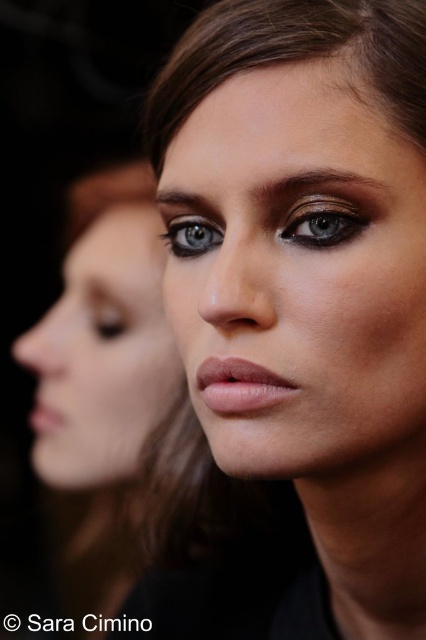
Can you confirm if matte skin face at center is positioned above matte brown eye at center?

Actually, matte skin face at center is below matte brown eye at center.

What do you see at coordinates (103, 355) in the screenshot?
I see `matte skin face at center` at bounding box center [103, 355].

Where is `matte skin face at center`? This screenshot has width=426, height=640. matte skin face at center is located at coordinates (103, 355).

Does matte skin face at center have a greater height compared to dark brown eyebrow at upper center?

Indeed, matte skin face at center has a greater height compared to dark brown eyebrow at upper center.

Is matte skin face at center to the right of dark brown eyebrow at upper center from the viewer's perspective?

No, matte skin face at center is not to the right of dark brown eyebrow at upper center.

Is point (132, 320) closer to viewer compared to point (198, 196)?

No, it is not.

What are the coordinates of `matte skin face at center` in the screenshot? It's located at (103, 355).

Between matte pink lips at center and matte pink lipstick at lower left, which one has less height?

Standing shorter between the two is matte pink lips at center.

Is matte pink lips at center taller than matte pink lipstick at lower left?

Incorrect, matte pink lips at center's height is not larger of matte pink lipstick at lower left's.

Where is `matte pink lips at center`? Image resolution: width=426 pixels, height=640 pixels. matte pink lips at center is located at coordinates (241, 387).

Find the location of a particular element. matte pink lips at center is located at coordinates (241, 387).